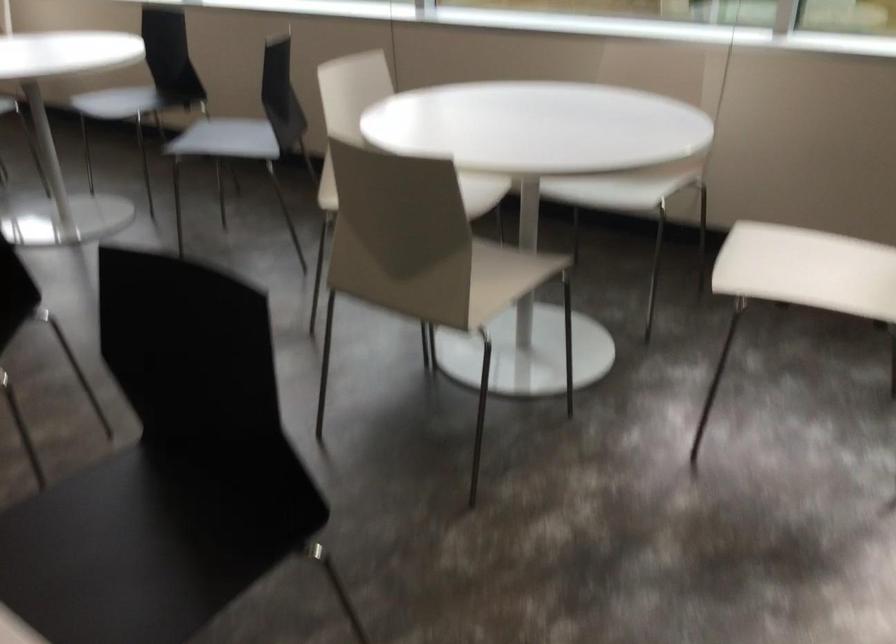
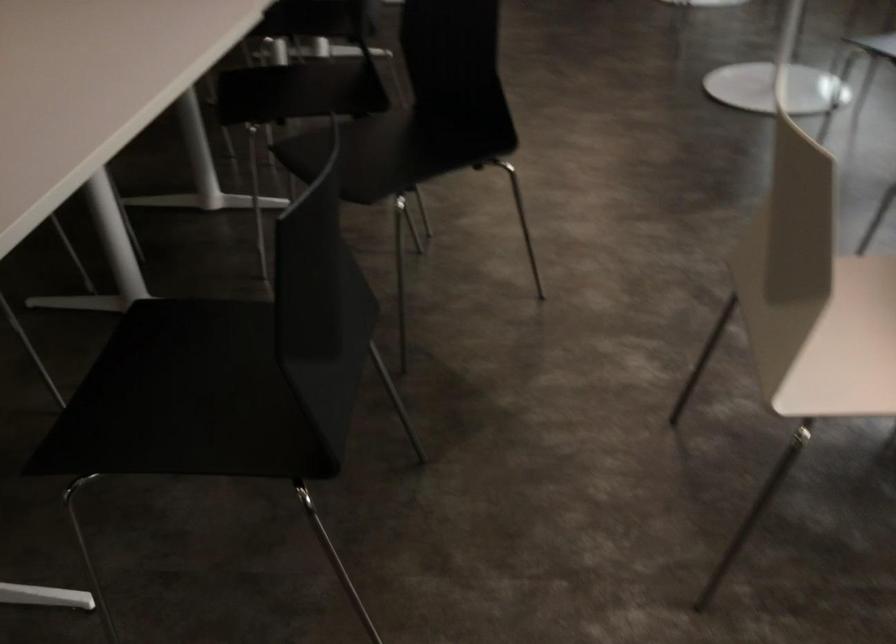
The first image is from the beginning of the video and the second image is from the end. How did the camera likely rotate when shooting the video?

The rotation direction of the camera is left-down.